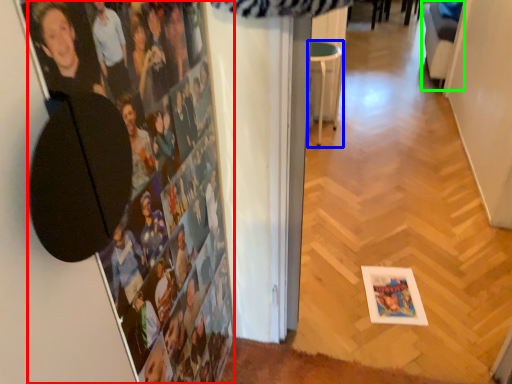
Question: Estimate the real-world distances between objects in this image. Which object is farther from person (highlighted by a red box), furniture (highlighted by a blue box) or swivel chair (highlighted by a green box)?

Choices:
 (A) furniture
 (B) swivel chair

Answer: (B)